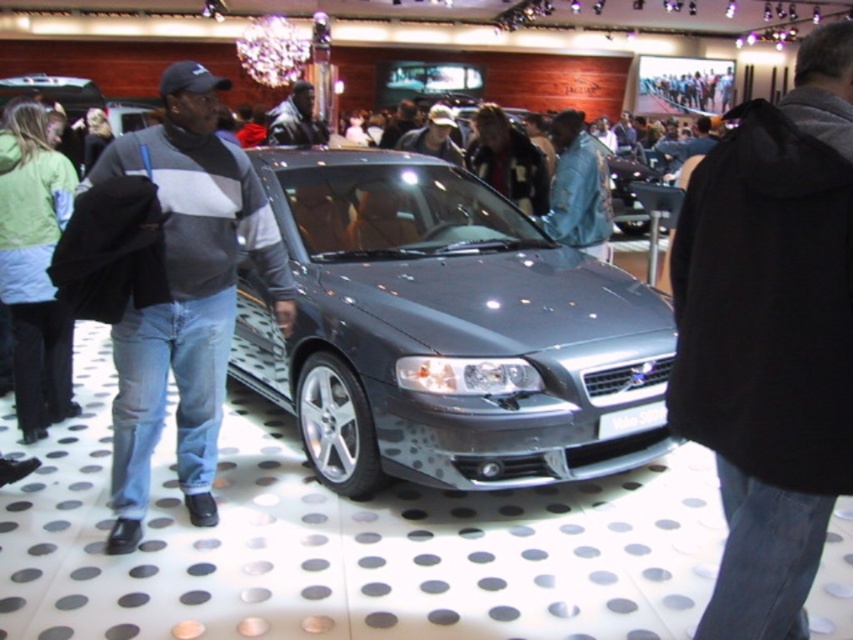
You are a salesperson in the car showroom and need to hand out brochures to two customers wearing the gray sweater at center and dark gray jacket at center. If you want to give the larger brochure first, which customer should you approach first?

The gray sweater at center has a larger size compared to the dark gray jacket at center. Therefore, you should give the larger brochure to the customer wearing the gray sweater at center first.

You are a salesperson in the car showroom and see two items at the center area, the gray sweater at center and the dark gray jacket at center. Which one is located to the right when facing the car?

The gray sweater at center is positioned on the right side of dark gray jacket at center, so the gray sweater at center is located to the right when facing the car.

You are a customer in the car showroom and want to touch both the satin metallic car at center and the gray sweater at center. Can you reach both without moving your position?

The satin metallic car at center and the gray sweater at center are 96.94 centimeters apart. Since the average human arm span is about 150 centimeters, you can easily reach both objects without moving your position.